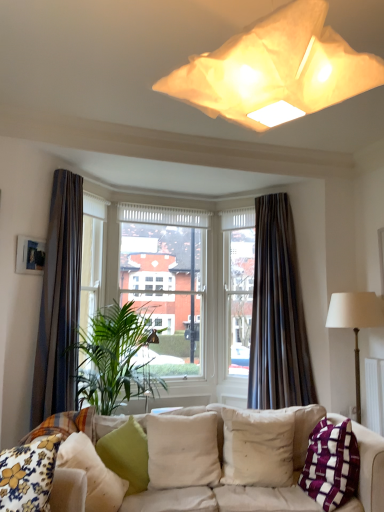
This screenshot has height=512, width=384. What are the coordinates of `brown fabric curtain at left, arranged as the first curtain when viewed from the left` in the screenshot? It's located at (59, 303).

What do you see at coordinates (238, 287) in the screenshot? The width and height of the screenshot is (384, 512). I see `clear glass window at center` at bounding box center [238, 287].

What do you see at coordinates (92, 474) in the screenshot? The image size is (384, 512). I see `green fabric pillow at lower left, arranged as the 2th pillow when viewed from the left` at bounding box center [92, 474].

This screenshot has height=512, width=384. I want to click on green fabric pillow at lower left, arranged as the 2th pillow when viewed from the left, so click(92, 474).

This screenshot has width=384, height=512. I want to click on dark velvet curtain at center, the second curtain from the left, so click(x=278, y=313).

What do you see at coordinates (221, 499) in the screenshot? I see `white fabric couch at lower center` at bounding box center [221, 499].

What are the coordinates of `white fabric couch at lower center` in the screenshot? It's located at (221, 499).

Locate an element on the screen. The width and height of the screenshot is (384, 512). wooden picture frame at upper left is located at coordinates (30, 255).

Identify the location of clear glass window at center. (167, 280).

Which object is positioned more to the right, wooden picture frame at upper left or green fabric pillow at lower left, which is counted as the 5th pillow, starting from the right?

green fabric pillow at lower left, which is counted as the 5th pillow, starting from the right.

Considering the relative sizes of wooden picture frame at upper left and green fabric pillow at lower left, arranged as the 2th pillow when viewed from the left, in the image provided, is wooden picture frame at upper left taller than green fabric pillow at lower left, arranged as the 2th pillow when viewed from the left,?

No, wooden picture frame at upper left is not taller than green fabric pillow at lower left, arranged as the 2th pillow when viewed from the left.

Is wooden picture frame at upper left positioned behind green fabric pillow at lower left, arranged as the 2th pillow when viewed from the left?

Yes, wooden picture frame at upper left is further from the camera.

Which is less distant, (16,268) or (86,458)?

Point (16,268).

Is point (240, 339) more distant than point (58, 309)?

Yes, it is.

From the image's perspective, between clear glass window at center and brown fabric curtain at left, which ranks as the second curtain in right-to-left order, which one is located above?

brown fabric curtain at left, which ranks as the second curtain in right-to-left order, appears higher in the image.

Locate an element on the screen. The width and height of the screenshot is (384, 512). window frame below the brown fabric curtain at left, arranged as the first curtain when viewed from the left (from the image's perspective) is located at coordinates (238, 287).

From a real-world perspective, which is physically below, clear glass window at center or brown fabric curtain at left, which ranks as the second curtain in right-to-left order?

In real-world perspective, clear glass window at center is lower.

From the image's perspective, starting from the beige fabric pillow at center, which is the 2th pillow from right to left, which curtain is the 1st one above? Please provide its 2D coordinates.

[(278, 313)]

Looking at this image, which is farther, (237, 453) or (254, 319)?

The point (254, 319) is farther from the camera.

Which object is positioned more to the left, beige fabric pillow at center, which is the 2th pillow from right to left, or dark velvet curtain at center, the second curtain from the left?

From the viewer's perspective, beige fabric pillow at center, which is the 2th pillow from right to left, appears more on the left side.

Is floral fabric cushion at lower left, the sixth pillow positioned from the right, not within wooden picture frame at upper left?

Indeed, floral fabric cushion at lower left, the sixth pillow positioned from the right, is completely outside wooden picture frame at upper left.

Considering the sizes of floral fabric cushion at lower left, the 1th pillow positioned from the left, and wooden picture frame at upper left in the image, is floral fabric cushion at lower left, the 1th pillow positioned from the left, wider or thinner than wooden picture frame at upper left?

floral fabric cushion at lower left, the 1th pillow positioned from the left, is wider than wooden picture frame at upper left.

Is floral fabric cushion at lower left, the 1th pillow positioned from the left, directly adjacent to wooden picture frame at upper left?

No, floral fabric cushion at lower left, the 1th pillow positioned from the left, is not touching wooden picture frame at upper left.

From a real-world perspective, is floral fabric cushion at lower left, the 1th pillow positioned from the left, below wooden picture frame at upper left?

Yes, from a real-world perspective, floral fabric cushion at lower left, the 1th pillow positioned from the left, is under wooden picture frame at upper left.

Who is more distant, clear glass window at center or dark velvet curtain at center, the second curtain from the left?

clear glass window at center.

From a real-world perspective, is clear glass window at center on top of dark velvet curtain at center, which ranks as the first curtain in right-to-left order?

Yes, from a real-world perspective, clear glass window at center is on top of dark velvet curtain at center, which ranks as the first curtain in right-to-left order.

There is a clear glass window at center. At what (x,y) coordinates should I click in order to perform the action: click on the 2nd curtain below it (from a real-world perspective). Please return your answer as a coordinate pair (x, y). The width and height of the screenshot is (384, 512). Looking at the image, I should click on (x=278, y=313).

Considering the sizes of clear glass window at center and dark velvet curtain at center, the second curtain from the left, in the image, is clear glass window at center taller or shorter than dark velvet curtain at center, the second curtain from the left,?

Clearly, clear glass window at center is shorter compared to dark velvet curtain at center, the second curtain from the left.

Is wooden picture frame at upper left looking in the opposite direction of beige fabric pillow at center, which is counted as the 4th pillow, starting from the left?

That's not correct — wooden picture frame at upper left is not looking away from beige fabric pillow at center, which is counted as the 4th pillow, starting from the left.

Which of these two, wooden picture frame at upper left or beige fabric pillow at center, which is counted as the 4th pillow, starting from the left, is smaller?

wooden picture frame at upper left is smaller.

What's the angular difference between green leafy plant at center and clear glass window at center's facing directions?

The angle between the facing direction of green leafy plant at center and the facing direction of clear glass window at center is 6.09 degrees.

Looking at this image, is green leafy plant at center taller or shorter than clear glass window at center?

Considering their sizes, green leafy plant at center has less height than clear glass window at center.

From a real-world perspective, is green leafy plant at center positioned above or below clear glass window at center?

green leafy plant at center is below clear glass window at center.

From the image's perspective, which is below, green leafy plant at center or clear glass window at center?

From the image's view, green leafy plant at center is below.

Where is `the 3rd pillow below the wooden picture frame at upper left (from a real-world perspective)`? The height and width of the screenshot is (512, 384). the 3rd pillow below the wooden picture frame at upper left (from a real-world perspective) is located at coordinates (92, 474).

There is a clear glass window at center. At what (x,y) coordinates should I click in order to perform the action: click on the 2nd curtain above it (from the image's perspective). Please return your answer as a coordinate pair (x, y). This screenshot has width=384, height=512. Looking at the image, I should click on (59, 303).

Looking at the image, which one is located further to green fabric pillow at lower left, which is counted as the 5th pillow, starting from the right, brown fabric curtain at left, arranged as the first curtain when viewed from the left, or green leafy plant at center?

brown fabric curtain at left, arranged as the first curtain when viewed from the left, lies further to green fabric pillow at lower left, which is counted as the 5th pillow, starting from the right, than the other object.

Estimate the real-world distances between objects in this image. Which object is further from green fabric cushion at lower left, the 4th pillow in the right-to-left sequence, white fabric couch at lower center or green leafy plant at center?

Among the two, green leafy plant at center is located further to green fabric cushion at lower left, the 4th pillow in the right-to-left sequence.

Estimate the real-world distances between objects in this image. Which object is closer to white fabric couch at lower center, purple woven pillow at lower right, the 6th pillow from the left, or green leafy plant at center?

The object closer to white fabric couch at lower center is purple woven pillow at lower right, the 6th pillow from the left.

From the picture: Estimate the real-world distances between objects in this image. Which object is further from matte paper lampshade at upper center, brown fabric curtain at left, which ranks as the second curtain in right-to-left order, or beige fabric pillow at center, which is the 2th pillow from right to left?

brown fabric curtain at left, which ranks as the second curtain in right-to-left order.

Which object lies nearer to the anchor point beige fabric pillow at center, which is the 2th pillow from right to left, green fabric pillow at lower left, which is counted as the 5th pillow, starting from the right, or matte paper lampshade at upper center?

Among the two, green fabric pillow at lower left, which is counted as the 5th pillow, starting from the right, is located nearer to beige fabric pillow at center, which is the 2th pillow from right to left.

In the scene shown: From the image, which object appears to be nearer to clear glass window at center, green fabric pillow at lower left, arranged as the 2th pillow when viewed from the left, or green fabric cushion at lower left, the 4th pillow in the right-to-left sequence?

The object closer to clear glass window at center is green fabric cushion at lower left, the 4th pillow in the right-to-left sequence.

Based on their spatial positions, is clear glass window at center or brown fabric curtain at left, arranged as the first curtain when viewed from the left, closer to green fabric cushion at lower left, which is counted as the 3th pillow, starting from the left?

brown fabric curtain at left, arranged as the first curtain when viewed from the left, is positioned closer to the anchor green fabric cushion at lower left, which is counted as the 3th pillow, starting from the left.

Estimate the real-world distances between objects in this image. Which object is further from green fabric pillow at lower left, which is counted as the 5th pillow, starting from the right, clear glass window at center or brown fabric curtain at left, which ranks as the second curtain in right-to-left order?

clear glass window at center lies further to green fabric pillow at lower left, which is counted as the 5th pillow, starting from the right, than the other object.

Where is `pillow between green fabric cushion at lower left, the 4th pillow in the right-to-left sequence, and beige fabric pillow at center, positioned as the fifth pillow in left-to-right order, in the horizontal direction`? pillow between green fabric cushion at lower left, the 4th pillow in the right-to-left sequence, and beige fabric pillow at center, positioned as the fifth pillow in left-to-right order, in the horizontal direction is located at coordinates click(x=183, y=450).

The image size is (384, 512). Identify the location of pillow positioned between beige fabric pillow at center, which is counted as the 4th pillow, starting from the left, and clear glass window at center from near to far. (257, 447).

Locate an element on the screen. studio couch between wooden picture frame at upper left and beige fabric pillow at center, positioned as the fifth pillow in left-to-right order, from left to right is located at coordinates (221, 499).

Image resolution: width=384 pixels, height=512 pixels. I want to click on houseplant between wooden picture frame at upper left and green fabric cushion at lower left, the 4th pillow in the right-to-left sequence, in the up-down direction, so click(115, 358).